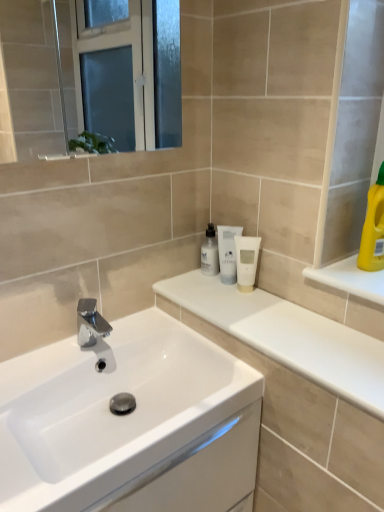
Question: Is chrome/metallic faucet at center inside transparent plastic bottle at center, the second mouthwash from the right?

Choices:
 (A) no
 (B) yes

Answer: (A)

Question: Is transparent plastic bottle at center, the second mouthwash from the right, in contact with chrome/metallic faucet at center?

Choices:
 (A) no
 (B) yes

Answer: (A)

Question: Is transparent plastic bottle at center, marked as the second mouthwash in a left-to-right arrangement, positioned in front of chrome/metallic faucet at center?

Choices:
 (A) yes
 (B) no

Answer: (B)

Question: Does transparent plastic bottle at center, marked as the second mouthwash in a left-to-right arrangement, have a lesser width compared to chrome/metallic faucet at center?

Choices:
 (A) no
 (B) yes

Answer: (B)

Question: Is transparent plastic bottle at center, the second mouthwash from the right, at the right side of chrome/metallic faucet at center?

Choices:
 (A) yes
 (B) no

Answer: (A)

Question: From the image's perspective, is transparent plastic bottle at center, marked as the second mouthwash in a left-to-right arrangement, below chrome/metallic faucet at center?

Choices:
 (A) no
 (B) yes

Answer: (A)

Question: Is chrome/metallic faucet at center at the back of white glossy counter at center?

Choices:
 (A) yes
 (B) no

Answer: (B)

Question: Can you confirm if white glossy counter at center is bigger than chrome/metallic faucet at center?

Choices:
 (A) no
 (B) yes

Answer: (B)

Question: Can you confirm if white glossy counter at center is positioned to the left of chrome/metallic faucet at center?

Choices:
 (A) no
 (B) yes

Answer: (A)

Question: From a real-world perspective, is white glossy counter at center positioned under chrome/metallic faucet at center based on gravity?

Choices:
 (A) no
 (B) yes

Answer: (A)

Question: Considering the relative positions of white glossy counter at center and chrome/metallic faucet at center in the image provided, is white glossy counter at center to the right of chrome/metallic faucet at center from the viewer's perspective?

Choices:
 (A) yes
 (B) no

Answer: (A)

Question: From the image's perspective, is white glossy counter at center located above chrome/metallic faucet at center?

Choices:
 (A) no
 (B) yes

Answer: (B)

Question: Can we say white glossy sink at center lies outside white matte tube at center, which ranks as the 1th mouthwash in right-to-left order?

Choices:
 (A) yes
 (B) no

Answer: (A)